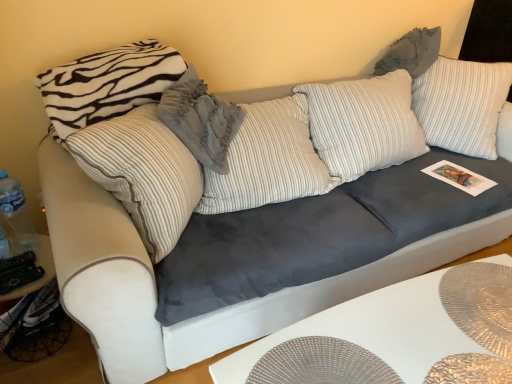
Question: Is velvety gray pillow at center, marked as the 2th pillow in a left-to-right arrangement, bigger than gray textured pillow at upper right, placed as the 1th pillow when sorted from right to left?

Choices:
 (A) yes
 (B) no

Answer: (A)

Question: Does velvety gray pillow at center, marked as the 2th pillow in a left-to-right arrangement, turn towards gray textured pillow at upper right, placed as the 1th pillow when sorted from right to left?

Choices:
 (A) yes
 (B) no

Answer: (B)

Question: Is gray textured pillow at upper right, placed as the 1th pillow when sorted from right to left, a part of velvety gray pillow at center, marked as the 2th pillow in a left-to-right arrangement?

Choices:
 (A) no
 (B) yes

Answer: (A)

Question: Does velvety gray pillow at center, marked as the 2th pillow in a left-to-right arrangement, come behind gray textured pillow at upper right, which is counted as the third pillow, starting from the left?

Choices:
 (A) no
 (B) yes

Answer: (A)

Question: Is velvety gray pillow at center, marked as the 2th pillow in a left-to-right arrangement, wider than gray textured pillow at upper right, placed as the 1th pillow when sorted from right to left?

Choices:
 (A) yes
 (B) no

Answer: (A)

Question: Can you see velvety gray pillow at center, placed as the second pillow when sorted from right to left, touching gray textured pillow at upper right, placed as the 1th pillow when sorted from right to left?

Choices:
 (A) yes
 (B) no

Answer: (B)

Question: Could you tell me if white striped pillow at upper left, positioned as the 3th pillow in right-to-left order, is facing velvety gray pillow at center, placed as the second pillow when sorted from right to left?

Choices:
 (A) no
 (B) yes

Answer: (B)

Question: Considering the relative sizes of white striped pillow at upper left, which is the 1th pillow in left-to-right order, and velvety gray pillow at center, placed as the second pillow when sorted from right to left, in the image provided, is white striped pillow at upper left, which is the 1th pillow in left-to-right order, shorter than velvety gray pillow at center, placed as the second pillow when sorted from right to left,?

Choices:
 (A) yes
 (B) no

Answer: (A)

Question: From a real-world perspective, is white striped pillow at upper left, positioned as the 3th pillow in right-to-left order, physically below velvety gray pillow at center, placed as the second pillow when sorted from right to left?

Choices:
 (A) no
 (B) yes

Answer: (A)

Question: Is white striped pillow at upper left, positioned as the 3th pillow in right-to-left order, outside velvety gray pillow at center, placed as the second pillow when sorted from right to left?

Choices:
 (A) no
 (B) yes

Answer: (B)

Question: From the image's perspective, is white striped pillow at upper left, positioned as the 3th pillow in right-to-left order, under velvety gray pillow at center, marked as the 2th pillow in a left-to-right arrangement?

Choices:
 (A) yes
 (B) no

Answer: (B)

Question: Is the depth of white striped pillow at upper left, which is the 1th pillow in left-to-right order, less than that of velvety gray pillow at center, placed as the second pillow when sorted from right to left?

Choices:
 (A) yes
 (B) no

Answer: (B)

Question: Is gray textured pillow at upper right, which is counted as the third pillow, starting from the left, bigger than white striped pillow at upper left, positioned as the 3th pillow in right-to-left order?

Choices:
 (A) no
 (B) yes

Answer: (A)